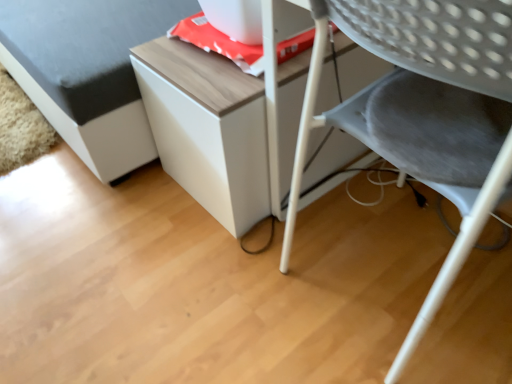
Question: From the image's perspective, would you say white matte cabinet at upper center is positioned over wooden table at center?

Choices:
 (A) no
 (B) yes

Answer: (B)

Question: From a real-world perspective, is white matte cabinet at upper center under wooden table at center?

Choices:
 (A) yes
 (B) no

Answer: (B)

Question: Is wooden table at center at the back of white matte cabinet at upper center?

Choices:
 (A) no
 (B) yes

Answer: (A)

Question: Can you confirm if white matte cabinet at upper center is shorter than wooden table at center?

Choices:
 (A) no
 (B) yes

Answer: (A)

Question: Can you confirm if white matte cabinet at upper center is positioned to the left of wooden table at center?

Choices:
 (A) no
 (B) yes

Answer: (B)

Question: Are white matte cabinet at upper center and wooden table at center far apart?

Choices:
 (A) no
 (B) yes

Answer: (A)

Question: From a real-world perspective, is wooden table at center located beneath gray fabric chair at lower right?

Choices:
 (A) no
 (B) yes

Answer: (B)

Question: Is wooden table at center located outside gray fabric chair at lower right?

Choices:
 (A) no
 (B) yes

Answer: (B)

Question: Does wooden table at center have a greater width compared to gray fabric chair at lower right?

Choices:
 (A) no
 (B) yes

Answer: (B)

Question: Is wooden table at center positioned before gray fabric chair at lower right?

Choices:
 (A) yes
 (B) no

Answer: (B)

Question: Considering the relative sizes of wooden table at center and gray fabric chair at lower right in the image provided, is wooden table at center shorter than gray fabric chair at lower right?

Choices:
 (A) yes
 (B) no

Answer: (A)

Question: Does wooden table at center appear on the left side of gray fabric chair at lower right?

Choices:
 (A) yes
 (B) no

Answer: (A)

Question: Is gray fabric chair at lower right not near wooden table at center?

Choices:
 (A) yes
 (B) no

Answer: (B)